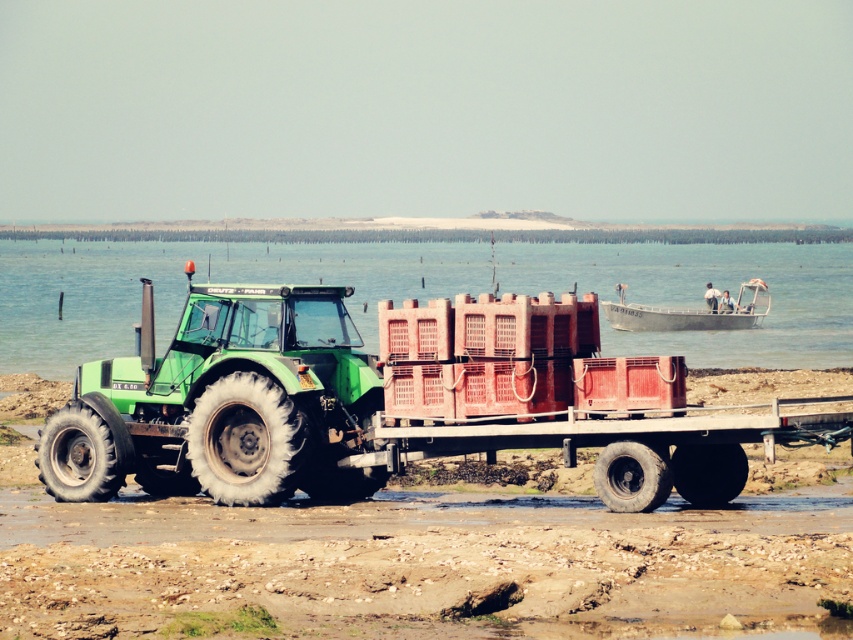
You are standing at the origin point of the coordinate system in this rural scene. The green rubber tractor at center is at position 0.870 on the x axis and 0.509 on the y axis. If you want to walk directly towards the tractor, which direction should you head in?

To reach the green rubber tractor at center located at coordinates 0.870 on the x axis and 0.509 on the y axis, you should head towards the northeast direction since the tractor is positioned to the right and slightly above your current position at the origin.

You are planning to drive the green rubber tractor at center and the green matte trailer truck at center through a narrow path that is only 2 meters wide. Based on their widths, which one do you think will have an easier time fitting through the path?

The green matte trailer truck at center might have an easier time fitting through the 2 meter wide path since the green rubber tractor at center might be wider than it.

Based on the scene description, what are the coordinates of the green matte trailer truck at center?

The green matte trailer truck at center is located at coordinates (392,401).